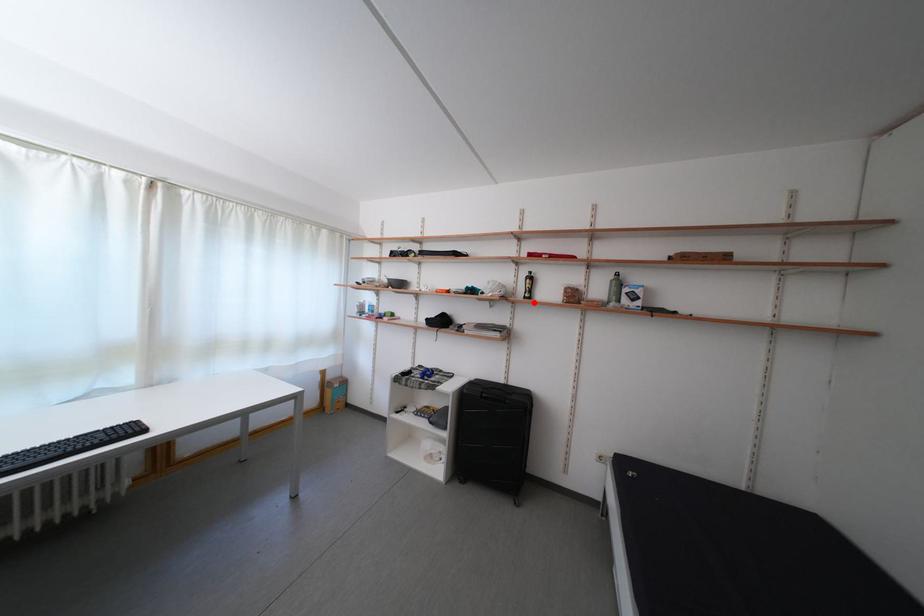
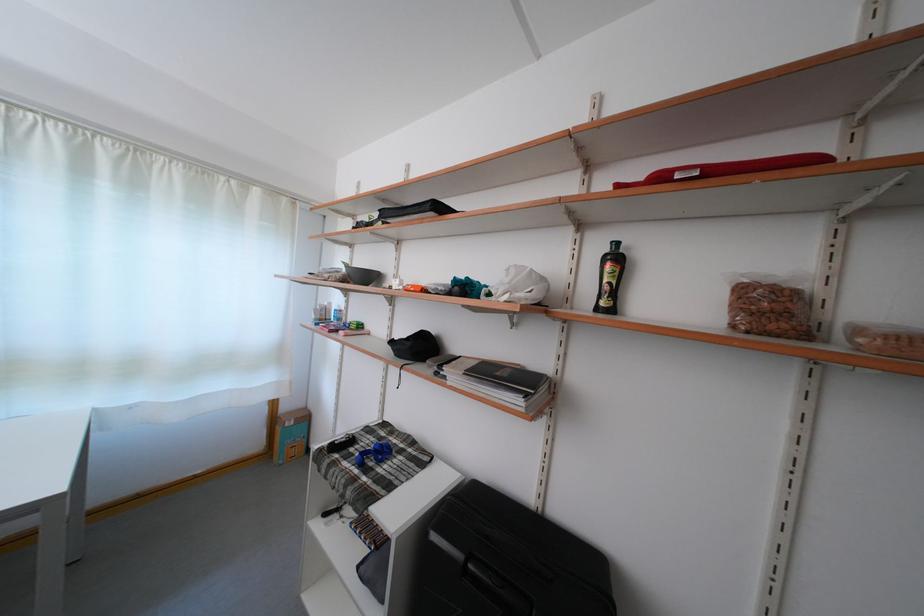
Find the pixel in the second image that matches the highlighted location in the first image.

(606, 314)